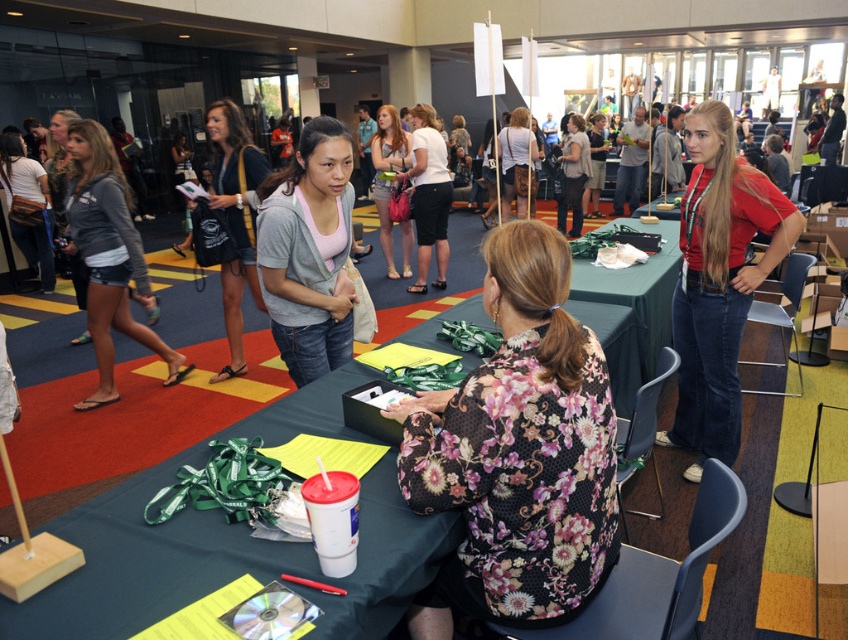
Is gray hoodie at left positioned at the back of matte black belt at left?

No, gray hoodie at left is in front of matte black belt at left.

Describe the element at coordinates (109, 257) in the screenshot. The width and height of the screenshot is (848, 640). I see `gray hoodie at left` at that location.

Does point (90, 154) lie in front of point (32, 209)?

Yes.

Where is `gray hoodie at left`? The width and height of the screenshot is (848, 640). gray hoodie at left is located at coordinates (109, 257).

Can you confirm if matte white shirt at center is positioned below matte gray hoodie at center?

Yes, matte white shirt at center is below matte gray hoodie at center.

Which is behind, point (417, 112) or point (562, 221)?

Point (562, 221)

Is point (434, 118) in front of point (565, 154)?

Yes, point (434, 118) is in front of point (565, 154).

Locate an element on the screen. matte white shirt at center is located at coordinates (428, 195).

From the picture: Between gray hoodie at left and matte gray hoodie at center, which one appears on the right side from the viewer's perspective?

Positioned to the right is matte gray hoodie at center.

Does point (90, 301) come behind point (583, 186)?

No, (90, 301) is in front of (583, 186).

Where is `gray hoodie at left`? gray hoodie at left is located at coordinates (109, 257).